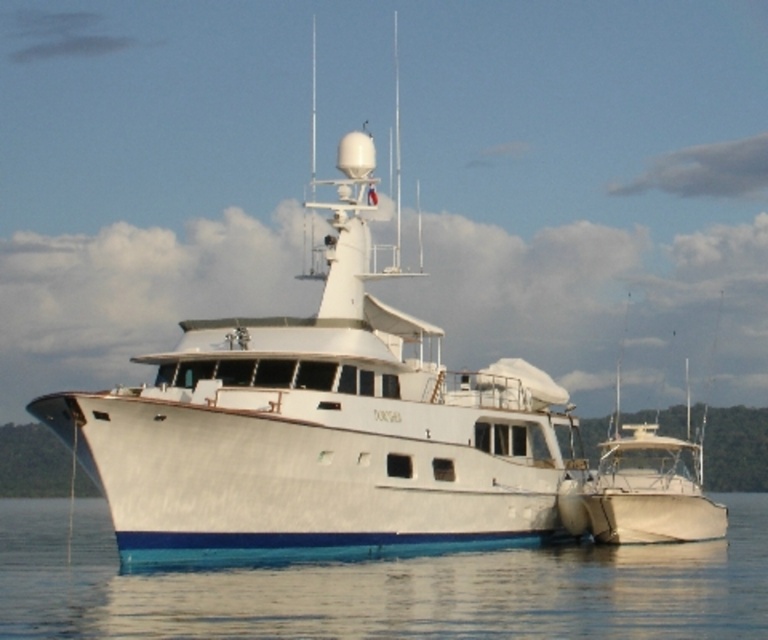
You are a photographer taking a picture of the white glossy boat at center and the clear water at lower center. Which object is located to the left of the other?

The white glossy boat at center is positioned on the left side of clear water at lower center.

You are a photographer trying to capture the white glossy boat at center from a specific vantage point. Given that the boat is located at coordinates point 0.661, 0.424 in the image, would you position your camera to the left or right of the boat to frame it best?

The white glossy boat at center is located at point (325, 422). To frame it best, position your camera to the right of the boat since the coordinates suggest it is closer to the right side of the image.